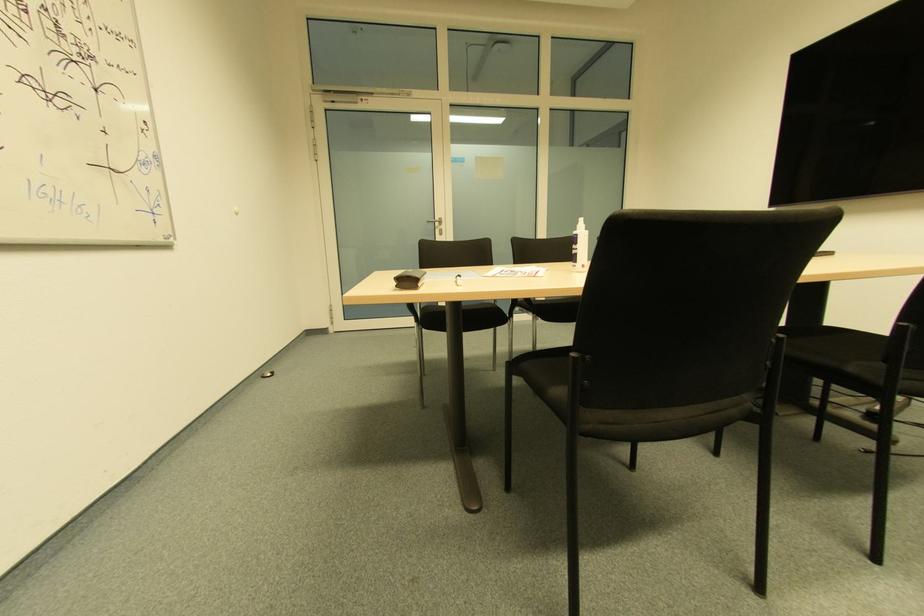
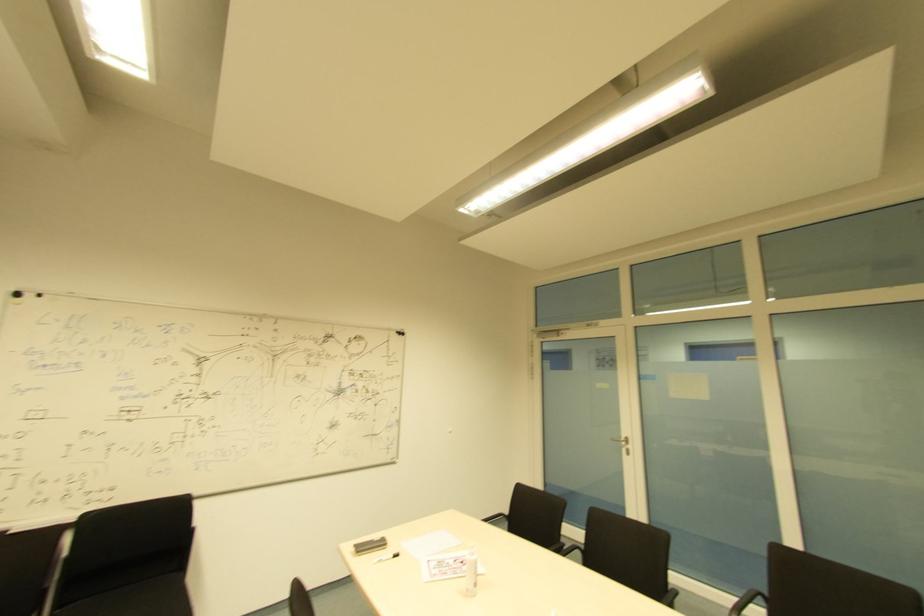
Locate, in the second image, the point that corresponds to pixel 440 230 in the first image.

(628, 450)